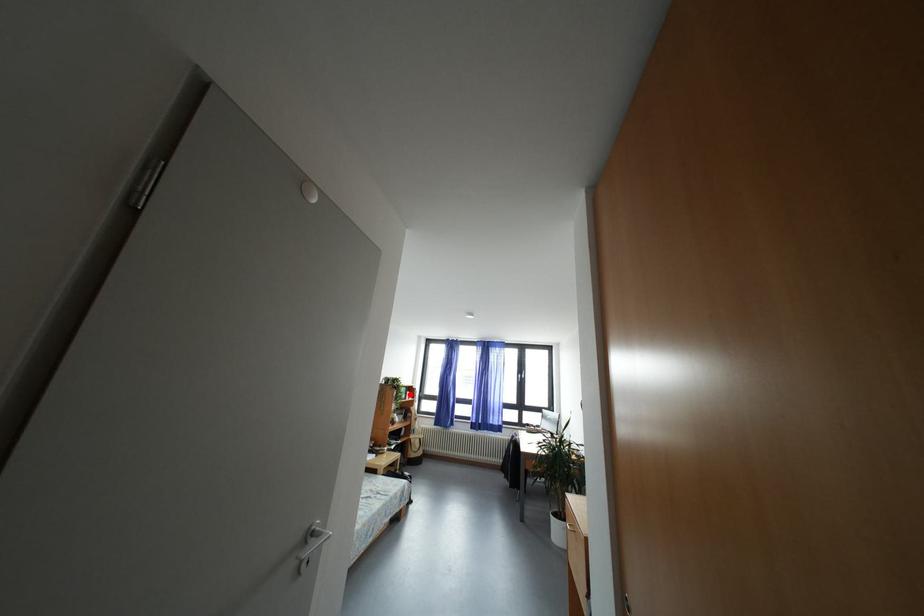
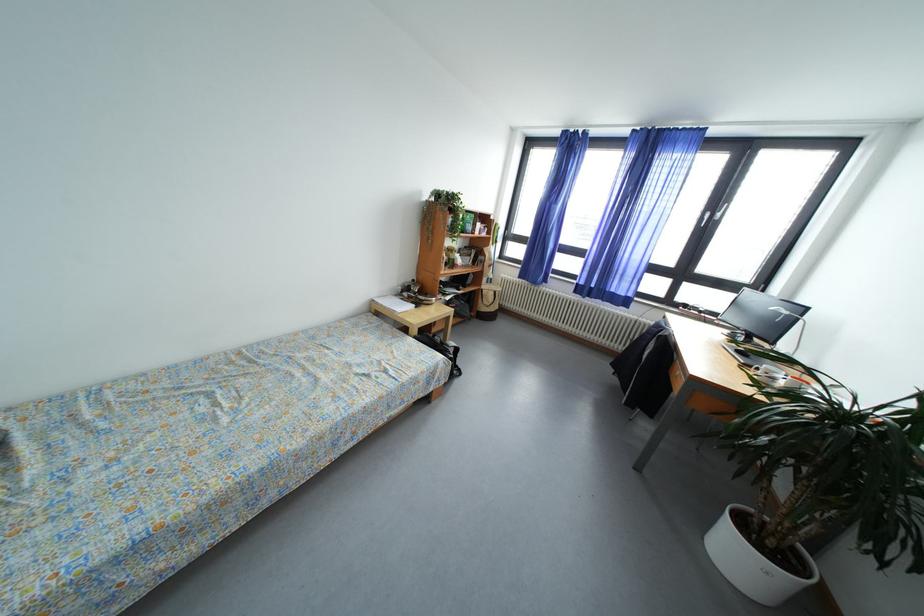
The point at the highlighted location is marked in the first image. Where is the corresponding point in the second image?

(477, 223)